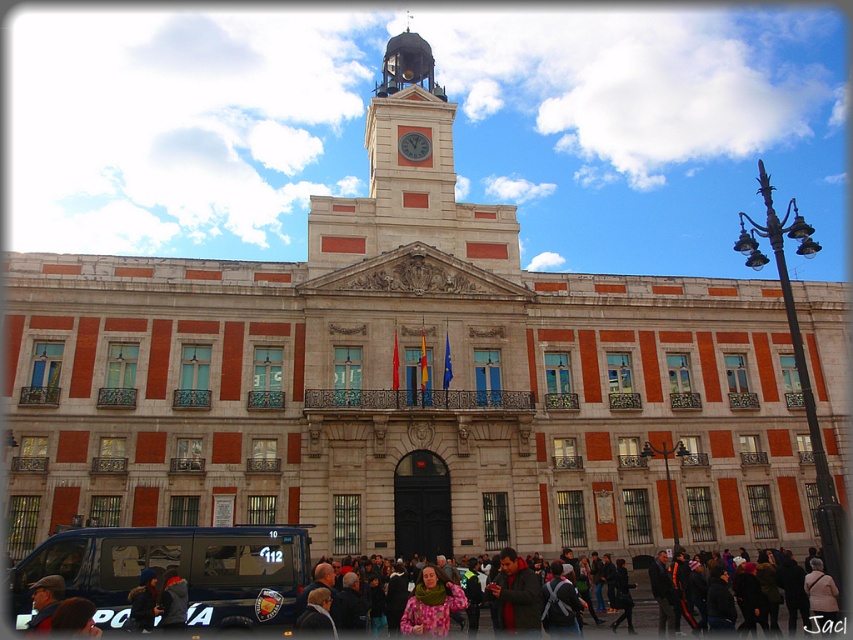
Question: Is polished bronze clock tower at center bigger than metallic clock face at center?

Choices:
 (A) no
 (B) yes

Answer: (B)

Question: Based on their relative distances, which object is farther from the metallic clock face at center?

Choices:
 (A) floral fabric scarf at center
 (B) polished bronze clock tower at center

Answer: (A)

Question: Can you confirm if floral fabric scarf at center is wider than metallic clock face at center?

Choices:
 (A) yes
 (B) no

Answer: (B)

Question: Estimate the real-world distances between objects in this image. Which object is farther from the polished bronze clock tower at center?

Choices:
 (A) floral fabric scarf at center
 (B) metallic clock face at center

Answer: (A)

Question: Based on their relative distances, which object is farther from the polished bronze clock tower at center?

Choices:
 (A) metallic clock face at center
 (B) floral fabric scarf at center

Answer: (B)

Question: Is floral fabric scarf at center to the right of metallic clock face at center from the viewer's perspective?

Choices:
 (A) no
 (B) yes

Answer: (B)